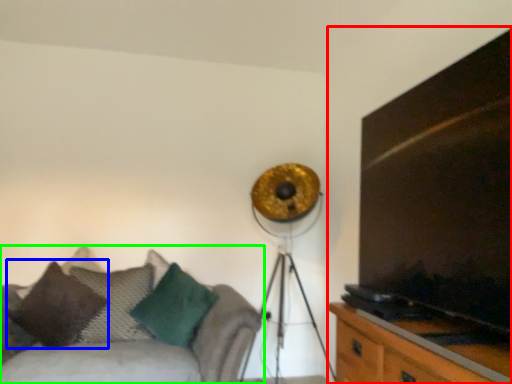
Question: Which is nearer to the entertainment center (highlighted by a red box)? pillow (highlighted by a blue box) or studio couch (highlighted by a green box).

Choices:
 (A) pillow
 (B) studio couch

Answer: (B)